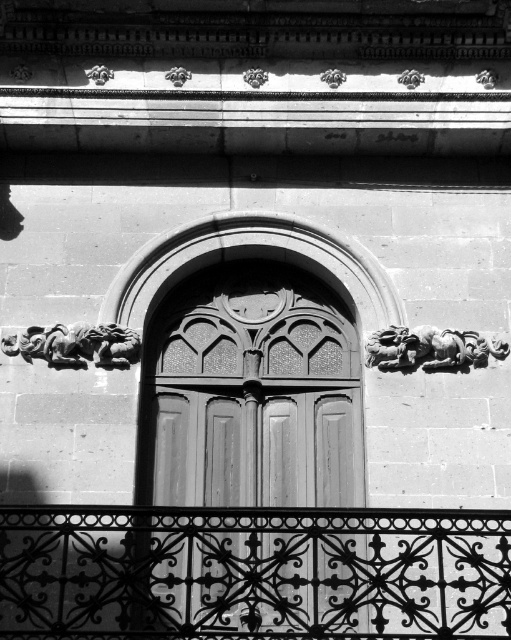
Is point (170, 573) in front of point (406, 355)?

Yes, point (170, 573) is closer to viewer.

Measure the distance between black wrought iron at lower center and polished stone sculpture at upper right.

black wrought iron at lower center and polished stone sculpture at upper right are 38.90 feet apart.

Find the location of a particular element. black wrought iron at lower center is located at coordinates (252, 572).

Is point (197, 372) farther from camera compared to point (11, 349)?

That is True.

Is matte wood door at center to the left of carved stone dragon at left from the viewer's perspective?

No, matte wood door at center is not to the left of carved stone dragon at left.

Image resolution: width=511 pixels, height=640 pixels. Find the location of `matte wood door at center`. matte wood door at center is located at coordinates (251, 394).

Is matte wood door at center smaller than black wrought iron at lower center?

No, matte wood door at center is not smaller than black wrought iron at lower center.

This screenshot has height=640, width=511. Identify the location of matte wood door at center. (251, 394).

Which is behind, point (241, 401) or point (387, 624)?

Positioned behind is point (241, 401).

The image size is (511, 640). Find the location of `matte wood door at center`. matte wood door at center is located at coordinates (251, 394).